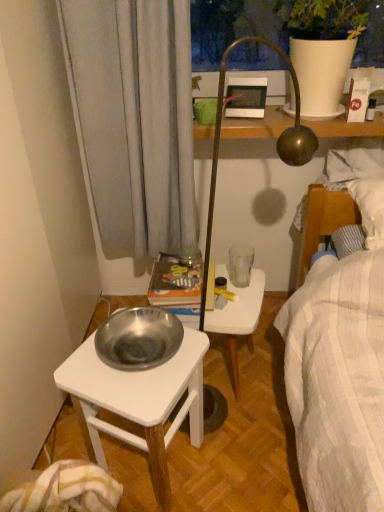
The image size is (384, 512). Find the location of `free region under white plastic stool at center (from a real-world perspective)`. free region under white plastic stool at center (from a real-world perspective) is located at coordinates (229, 374).